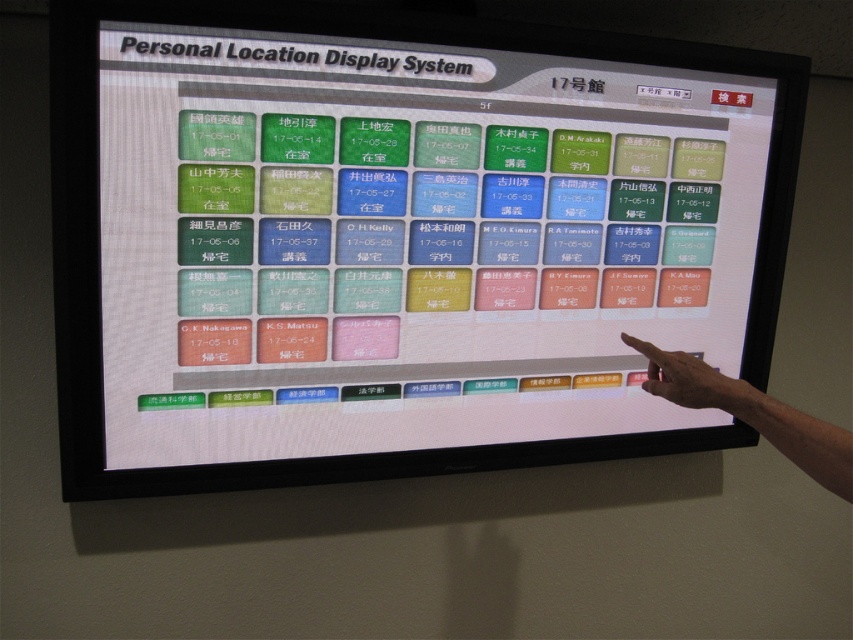
You are standing in front of a digital display system. You notice a white glossy monitor at center and a skin tone finger at upper right. Which object is located to the left of the other?

The white glossy monitor at center is positioned on the left side of skin tone finger at upper right.